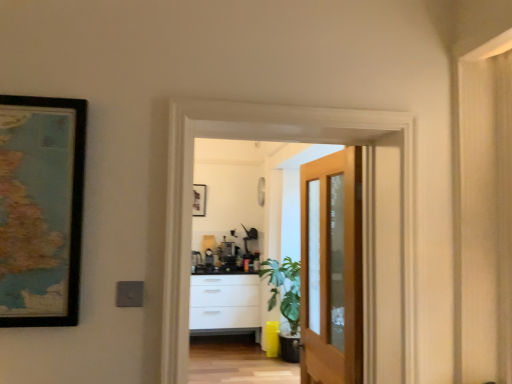
Question: From a real-world perspective, does wooden-framed map at left sit lower than wooden screen door at center?

Choices:
 (A) yes
 (B) no

Answer: (B)

Question: Considering the relative positions of wooden-framed map at left and wooden screen door at center in the image provided, is wooden-framed map at left to the right of wooden screen door at center from the viewer's perspective?

Choices:
 (A) no
 (B) yes

Answer: (A)

Question: Is wooden-framed map at left next to wooden screen door at center and touching it?

Choices:
 (A) no
 (B) yes

Answer: (A)

Question: Is wooden-framed map at left to the left of wooden screen door at center from the viewer's perspective?

Choices:
 (A) yes
 (B) no

Answer: (A)

Question: Does wooden-framed map at left turn towards wooden screen door at center?

Choices:
 (A) yes
 (B) no

Answer: (B)

Question: Can you confirm if wooden-framed map at left is thinner than wooden screen door at center?

Choices:
 (A) no
 (B) yes

Answer: (B)

Question: From a real-world perspective, is light brown wooden door at center over wooden screen door at center?

Choices:
 (A) yes
 (B) no

Answer: (B)

Question: Is light brown wooden door at center not inside wooden screen door at center?

Choices:
 (A) yes
 (B) no

Answer: (A)

Question: Considering the relative positions of light brown wooden door at center and wooden screen door at center in the image provided, is light brown wooden door at center to the left of wooden screen door at center from the viewer's perspective?

Choices:
 (A) yes
 (B) no

Answer: (B)

Question: From a real-world perspective, is light brown wooden door at center located beneath wooden screen door at center?

Choices:
 (A) no
 (B) yes

Answer: (B)

Question: Is light brown wooden door at center turned away from wooden screen door at center?

Choices:
 (A) no
 (B) yes

Answer: (A)

Question: Does light brown wooden door at center contain wooden screen door at center?

Choices:
 (A) yes
 (B) no

Answer: (B)

Question: Is wooden screen door at center aimed at light brown wooden door at center?

Choices:
 (A) no
 (B) yes

Answer: (A)